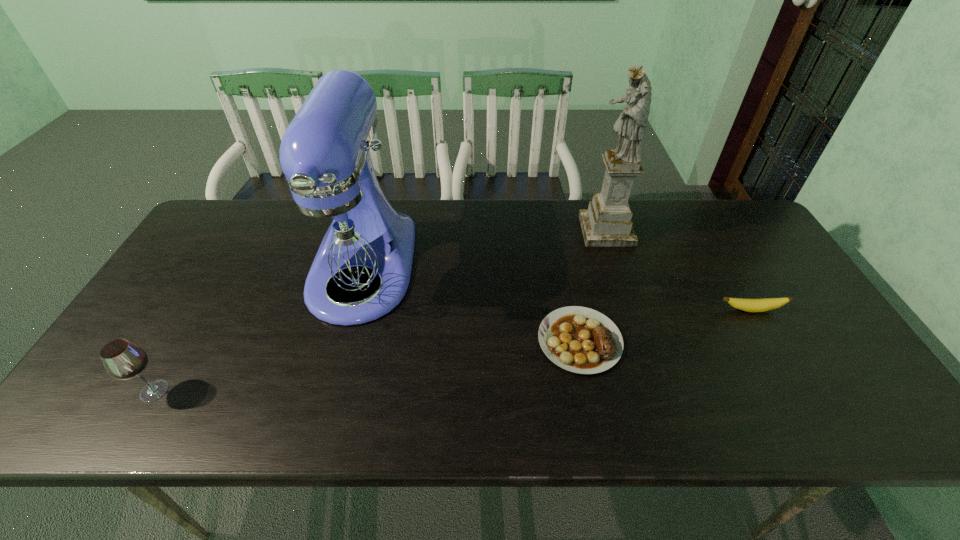
Find the location of a particular element. vacant position in the image that satisfies the following two spatial constraints: 1. on the back side of the banana; 2. on the right side of the third shortest object is located at coordinates (202, 310).

Locate an element on the screen. This screenshot has height=540, width=960. blank area in the image that satisfies the following two spatial constraints: 1. on the back side of the steak; 2. on the left side of the rightmost object is located at coordinates (574, 310).

Identify the location of blank area in the image that satisfies the following two spatial constraints: 1. on the front-facing side of the sculpture; 2. at the mixing area of the mixer. (618, 268).